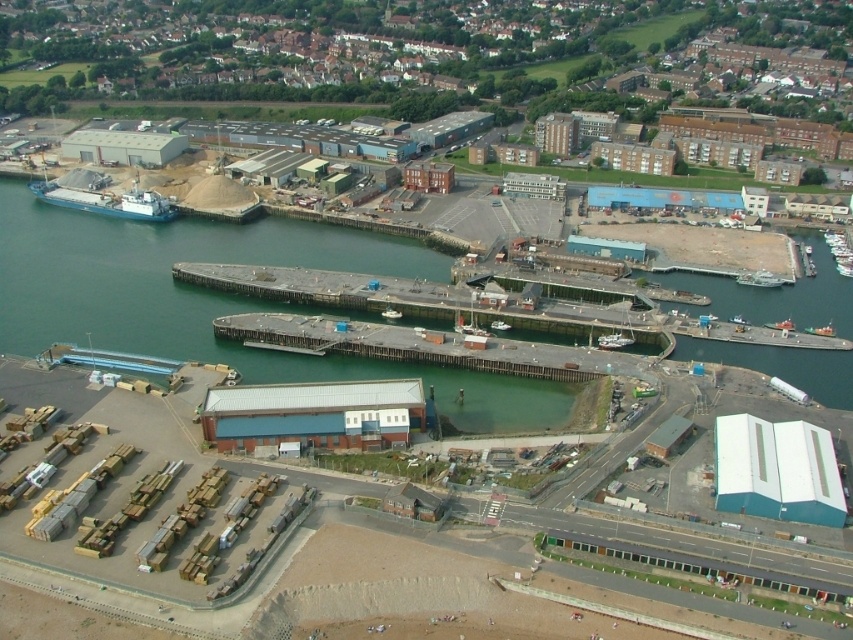
You are a port authority inspector tasked with ensuring that all vessels adhere to size regulations. You observe the green matte cargo ship at center and the white plastic boat at center in the port. Based on their widths, which vessel is wider?

The green matte cargo ship at center is wider than the white plastic boat at center, as its width surpasses that of the white plastic boat at center.

You are a drone operator flying above the industrial port area. You need to determine which of the two points, point (599, 346) or point (491, 321), is closer to your current position. Based on the image, which point is nearer to you?

Point (599, 346) is closer to the camera than point (491, 321), so it is nearer to your current position as a drone operator.